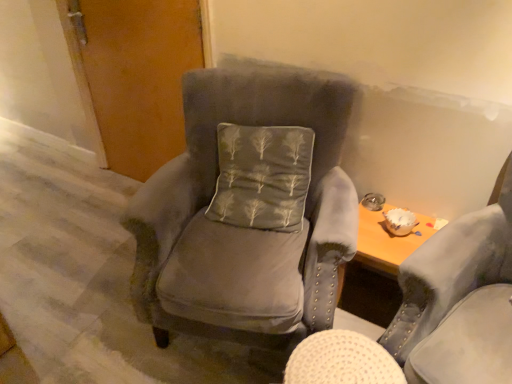
Question: Looking at their shapes, would you say matte wood door at upper left is wider or thinner than satin gray pillow at center?

Choices:
 (A) wide
 (B) thin

Answer: (B)

Question: Based on their sizes in the image, would you say matte wood door at upper left is bigger or smaller than satin gray pillow at center?

Choices:
 (A) small
 (B) big

Answer: (B)

Question: Estimate the real-world distances between objects in this image. Which object is farther from the velvet gray armchair at center, which ranks as the 1th chair in right-to-left order?

Choices:
 (A) satin gray pillow at center
 (B) velvet gray chair at center, which appears as the 1th chair when viewed from the left
 (C) matte wood door at upper left

Answer: (C)

Question: Estimate the real-world distances between objects in this image. Which object is farther from the matte wood door at upper left?

Choices:
 (A) satin gray pillow at center
 (B) velvet gray armchair at center, which ranks as the 1th chair in right-to-left order
 (C) velvet gray chair at center, which appears as the 1th chair when viewed from the left

Answer: (B)